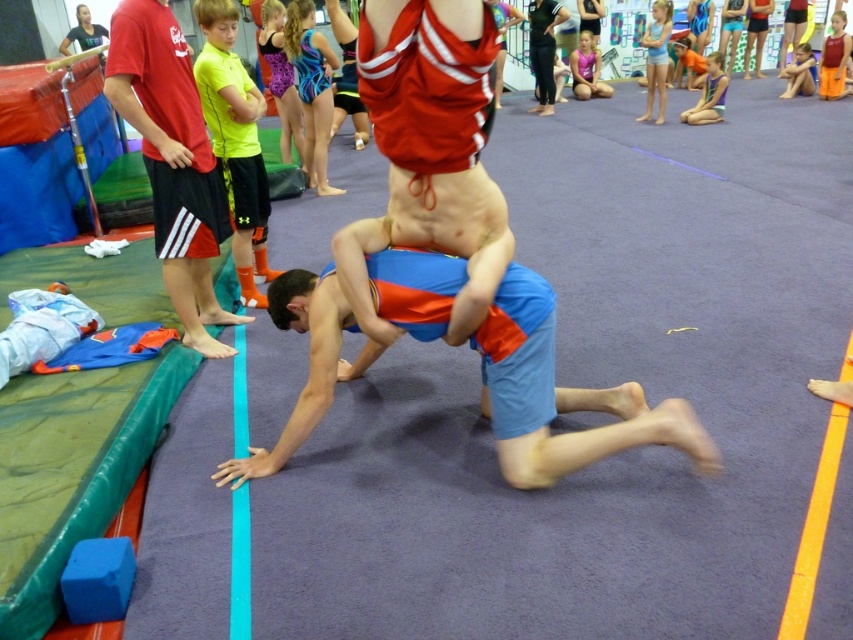
You are organizing a sports equipment storage room. You have two items to place on a shelf that can only hold one item at a time. The items are the blue cotton shorts at center and the yellow matte shirt at upper left. Based on their sizes, which item should you place first to maximize shelf space efficiency?

The blue cotton shorts at center is larger in size than the yellow matte shirt at upper left. To maximize shelf space efficiency, you should place the larger item, the blue cotton shorts at center, first so that the smaller yellow matte shirt at upper left can be placed in the remaining space.